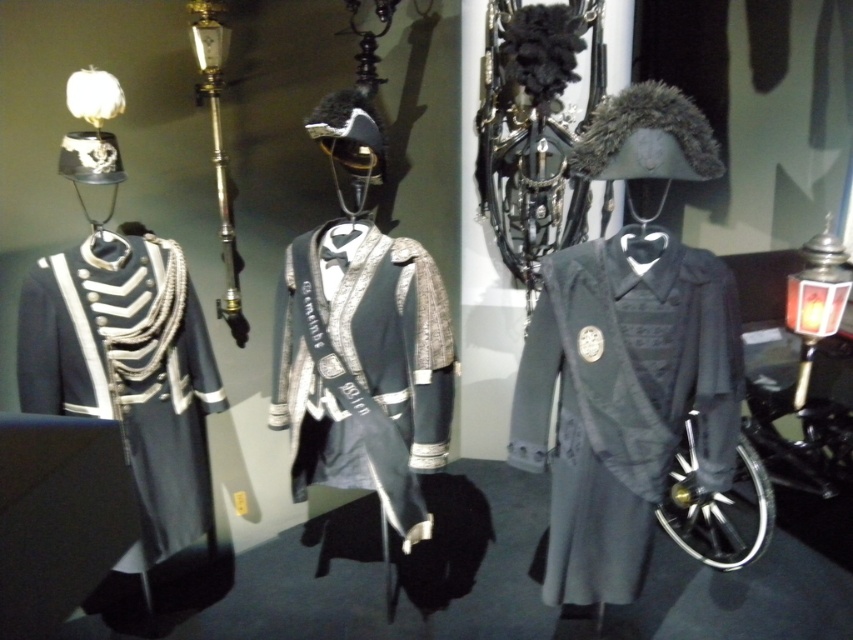
Question: Does matte black coat at center appear on the left side of shiny silver jacket at center?

Choices:
 (A) yes
 (B) no

Answer: (B)

Question: Can you confirm if matte black coat at center is thinner than shiny silver jacket at center?

Choices:
 (A) no
 (B) yes

Answer: (A)

Question: Which object is farther from the camera taking this photo?

Choices:
 (A) matte black coat at center
 (B) shiny silver jacket at center

Answer: (B)

Question: Which point is farther to the camera?

Choices:
 (A) (306, 275)
 (B) (705, 323)

Answer: (A)

Question: Which point appears farthest from the camera in this image?

Choices:
 (A) (573, 449)
 (B) (335, 378)

Answer: (B)

Question: Does matte black coat at center appear under shiny silver jacket at center?

Choices:
 (A) yes
 (B) no

Answer: (A)